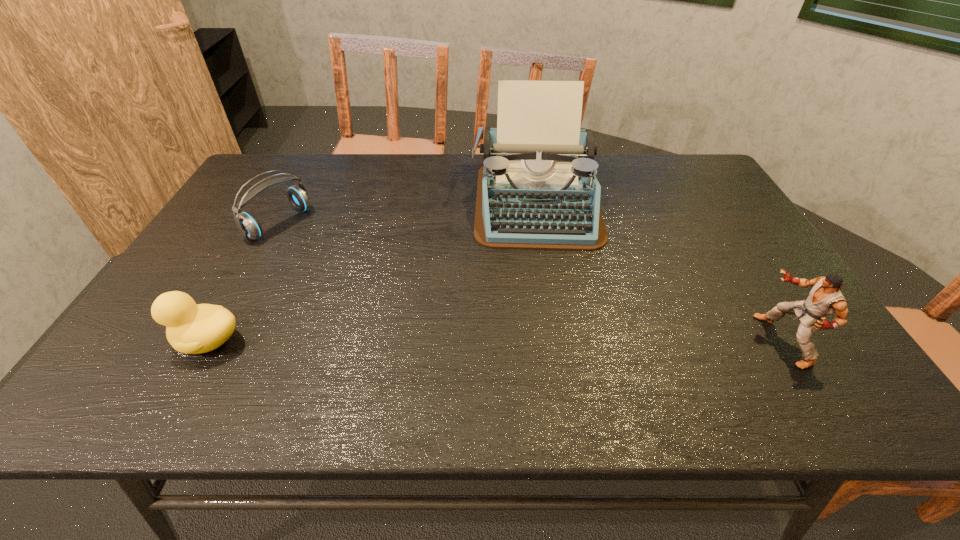
Where is `headset positioned at the left edge`? headset positioned at the left edge is located at coordinates (249, 227).

The height and width of the screenshot is (540, 960). I want to click on object present at the right edge, so click(825, 298).

Where is `object that is at the near left corner`? object that is at the near left corner is located at coordinates point(191,328).

Where is `object located at the near right corner`? object located at the near right corner is located at coordinates [825, 298].

This screenshot has width=960, height=540. Identify the location of vacant space at the far edge. (446, 177).

Image resolution: width=960 pixels, height=540 pixels. In the image, there is a desktop. Find the location of `vacant space at the left edge`. vacant space at the left edge is located at coordinates (223, 299).

This screenshot has width=960, height=540. In order to click on vacant space at the right edge of the desktop in this screenshot , I will do `click(767, 330)`.

Where is `vacant area at the far left corner of the desktop`? Image resolution: width=960 pixels, height=540 pixels. vacant area at the far left corner of the desktop is located at coordinates (278, 164).

Identify the location of vacant point located between the headset and the third shortest object. Image resolution: width=960 pixels, height=540 pixels. (531, 282).

The width and height of the screenshot is (960, 540). In order to click on vacant area that lies between the second tallest object and the typewriter in this screenshot , I will do `click(660, 272)`.